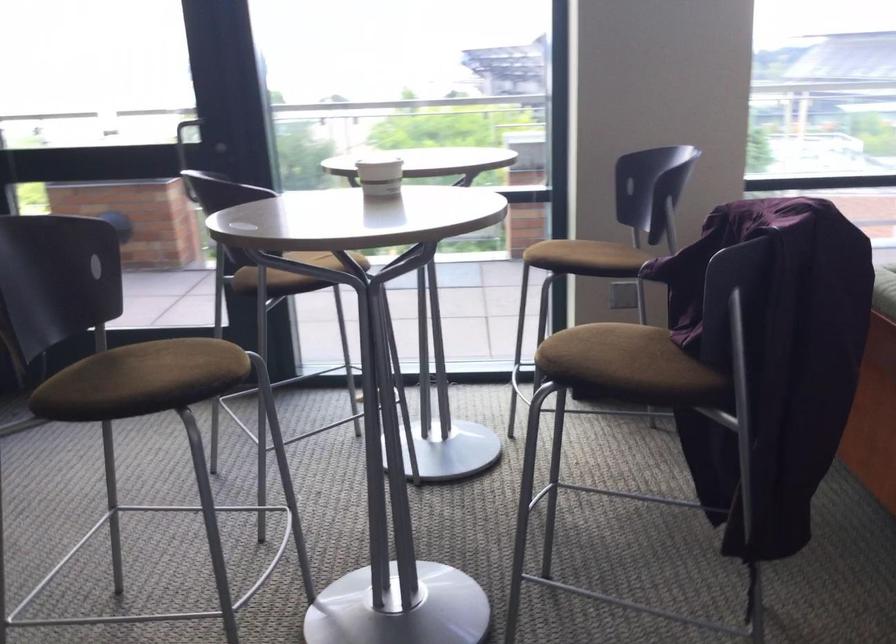
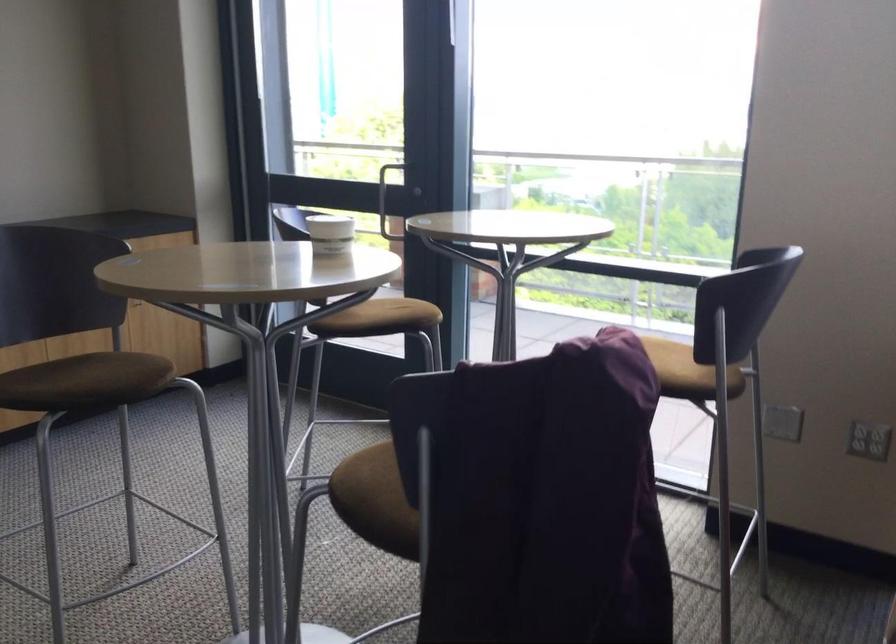
Locate, in the second image, the point that corresponds to (x=382, y=176) in the first image.

(330, 234)